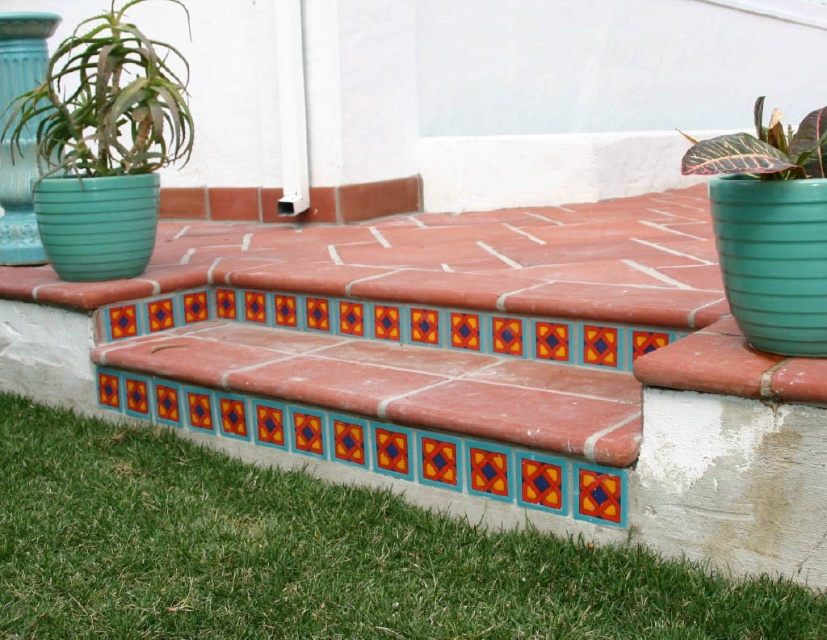
Question: Can you confirm if green matte pot at upper left is thinner than multicolored tile at center?

Choices:
 (A) no
 (B) yes

Answer: (A)

Question: Does terracotta tile bench at center come behind green grass at lower left?

Choices:
 (A) yes
 (B) no

Answer: (A)

Question: Estimate the real-world distances between objects in this image. Which object is closer to the leathery green leaf at right?

Choices:
 (A) green matte pot at upper left
 (B) terracotta tile bench at center
 (C) multicolored tile at center
 (D) green grass at lower left

Answer: (C)

Question: Can you confirm if leathery green leaf at right is positioned above multicolored tile at center?

Choices:
 (A) yes
 (B) no

Answer: (A)

Question: Which point is farther to the camera?

Choices:
 (A) (324, 246)
 (B) (362, 604)
 (C) (732, 157)
 (D) (577, 509)

Answer: (A)

Question: Which of the following is the closest to the observer?

Choices:
 (A) (185, 96)
 (B) (0, 428)

Answer: (B)